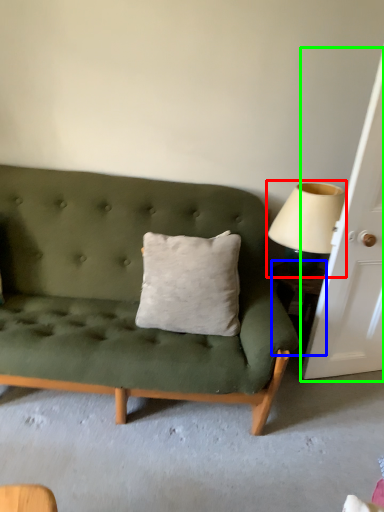
Question: Which is farther away from table lamp (highlighted by a red box)? table (highlighted by a blue box) or door (highlighted by a green box)?

Choices:
 (A) table
 (B) door

Answer: (A)